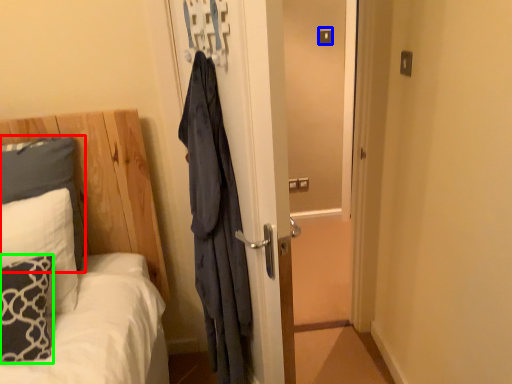
Question: Which object is positioned farthest from pillow (highlighted by a red box)? Select from light switch (highlighted by a blue box) and pillow (highlighted by a green box).

Choices:
 (A) light switch
 (B) pillow

Answer: (A)